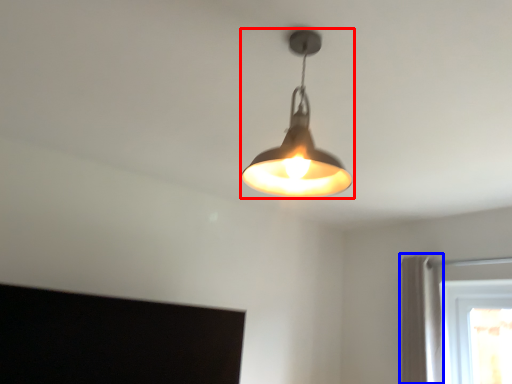
Question: Which of the following is the farthest to the observer, lamp (highlighted by a red box) or curtain (highlighted by a blue box)?

Choices:
 (A) lamp
 (B) curtain

Answer: (B)